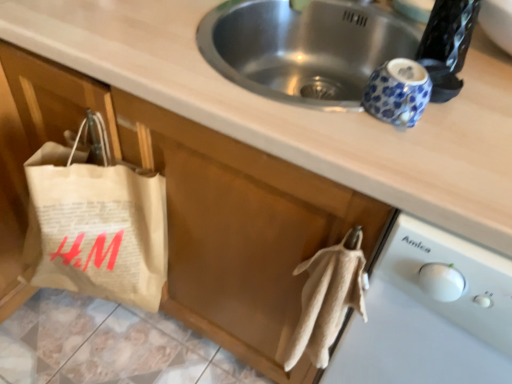
Question: From the image's perspective, relative to white plastic dishwasher at lower right, is natural paper bag at left above or below?

Choices:
 (A) above
 (B) below

Answer: (A)

Question: Considering the positions of point (121, 233) and point (442, 372), is point (121, 233) closer or farther from the camera than point (442, 372)?

Choices:
 (A) farther
 (B) closer

Answer: (A)

Question: In terms of height, does natural paper bag at left look taller or shorter compared to white plastic dishwasher at lower right?

Choices:
 (A) tall
 (B) short

Answer: (B)

Question: Do you think white plastic dishwasher at lower right is within natural paper bag at left, or outside of it?

Choices:
 (A) outside
 (B) inside

Answer: (A)

Question: Is point (488, 291) closer or farther from the camera than point (111, 170)?

Choices:
 (A) farther
 (B) closer

Answer: (B)

Question: From a real-world perspective, is white plastic dishwasher at lower right physically located above or below natural paper bag at left?

Choices:
 (A) above
 (B) below

Answer: (B)

Question: From the image's perspective, relative to natural paper bag at left, is white plastic dishwasher at lower right above or below?

Choices:
 (A) above
 (B) below

Answer: (B)